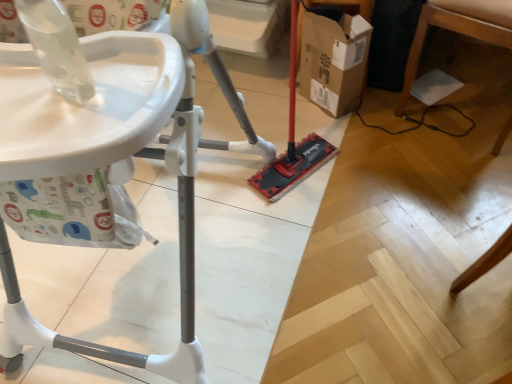
At what (x,y) coordinates should I click in order to perform the action: click on blank space to the left of cardboard box at center. Please return your answer as a coordinate pair (x, y). Looking at the image, I should click on (280, 111).